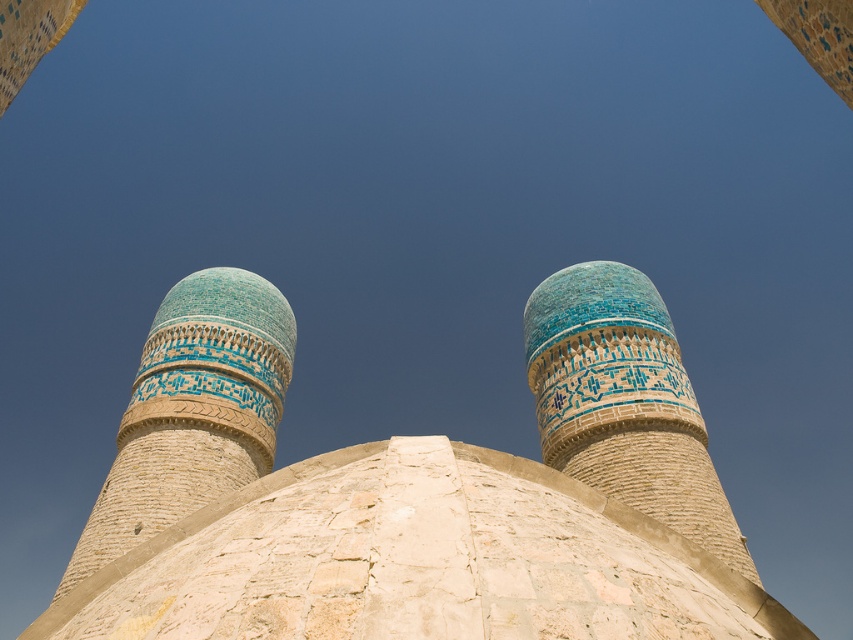
Is turquoise mosaic dome at center above blue glazed brick minaret at center?

Correct, turquoise mosaic dome at center is located above blue glazed brick minaret at center.

Can you confirm if turquoise mosaic dome at center is taller than blue glazed brick minaret at center?

No, turquoise mosaic dome at center is not taller than blue glazed brick minaret at center.

At what (x,y) coordinates should I click in order to perform the action: click on turquoise mosaic dome at center. Please return your answer as a coordinate pair (x, y). This screenshot has height=640, width=853. Looking at the image, I should click on (624, 403).